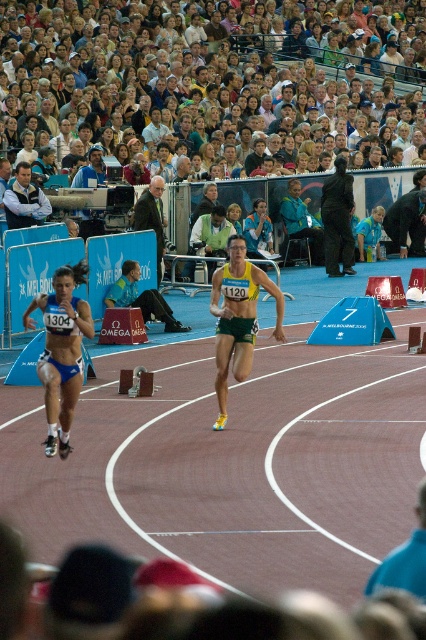
Question: Does light blue shirt at center have a larger size compared to light brown hair at center?

Choices:
 (A) no
 (B) yes

Answer: (B)

Question: Is light brown hair at upper center below light blue fabric jacket at upper center?

Choices:
 (A) yes
 (B) no

Answer: (B)

Question: Which of the following is the closest to the observer?

Choices:
 (A) (244, 275)
 (B) (26, 195)
 (C) (141, 296)
 (D) (204, 160)

Answer: (A)

Question: Estimate the real-world distances between objects in this image. Which object is farther from the light brown hair at upper center?

Choices:
 (A) light blue fabric jacket at upper center
 (B) yellow-green athletic suit at center

Answer: (B)

Question: Can you confirm if dark blue suit at center is positioned to the right of dark brown suit at center?

Choices:
 (A) yes
 (B) no

Answer: (A)

Question: Which of the following is the farthest from the observer?

Choices:
 (A) (109, 131)
 (B) (81, 372)
 (C) (224, 253)
 (D) (158, 205)

Answer: (A)